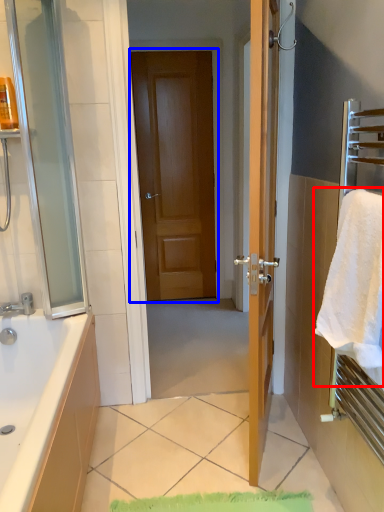
Question: Which point is closer to the camera, beach towel (highlighted by a red box) or door (highlighted by a blue box)?

Choices:
 (A) beach towel
 (B) door

Answer: (A)